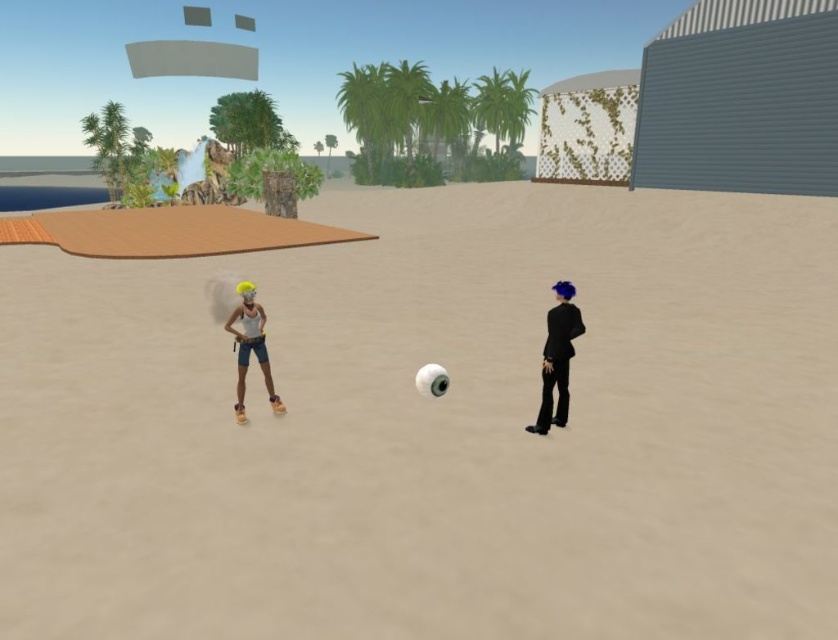
Question: Which of the following is the closest to the observer?

Choices:
 (A) shiny black suit at right
 (B) beige sand at center

Answer: (B)

Question: Does beige sand at center have a smaller size compared to shiny black suit at right?

Choices:
 (A) no
 (B) yes

Answer: (A)

Question: Is shiny black suit at right in front of matte yellow hair at center?

Choices:
 (A) yes
 (B) no

Answer: (A)

Question: Which point is farther to the camera?

Choices:
 (A) (562, 314)
 (B) (385, 237)

Answer: (B)

Question: Is shiny black suit at right below matte yellow hair at center?

Choices:
 (A) no
 (B) yes

Answer: (A)

Question: Among these objects, which one is farthest from the camera?

Choices:
 (A) beige sand at center
 (B) shiny black suit at right
 (C) matte yellow hair at center

Answer: (C)